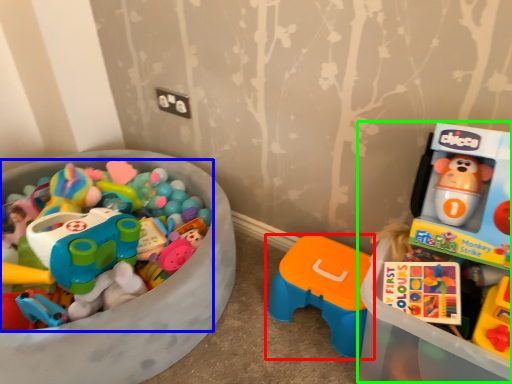
Question: Based on their relative distances, which object is farther from toy (highlighted by a red box)? Choose from toy (highlighted by a blue box) and toyshop (highlighted by a green box).

Choices:
 (A) toy
 (B) toyshop

Answer: (A)